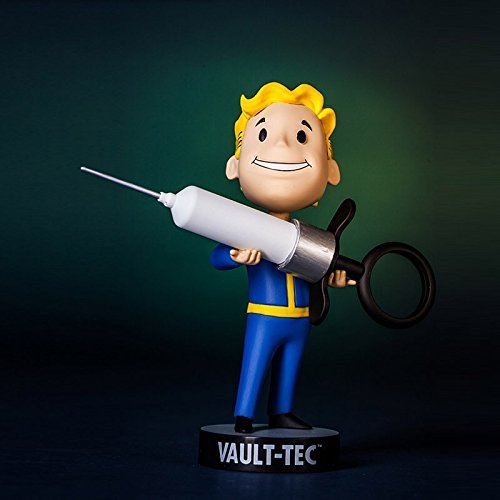
Find the location of a particular element. The image size is (500, 500). plunger is located at coordinates (370, 264).